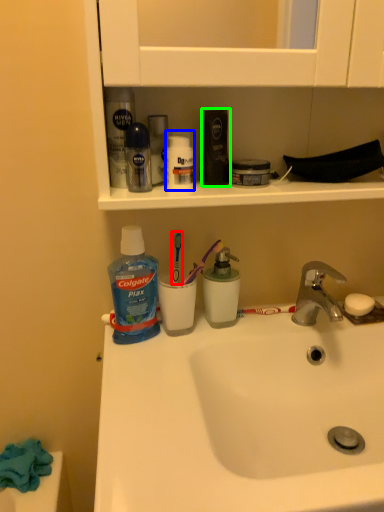
Question: Considering the real-world distances, which object is closest to toothbrush (highlighted by a red box)? toiletry (highlighted by a blue box) or toiletry (highlighted by a green box).

Choices:
 (A) toiletry
 (B) toiletry

Answer: (A)